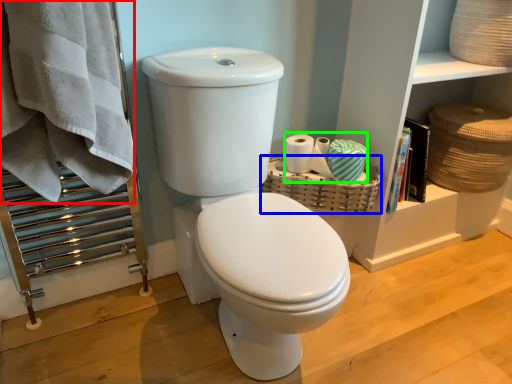
Question: Based on their relative distances, which object is farther from bath towel (highlighted by a red box)? Choose from basket (highlighted by a blue box) and toilet paper (highlighted by a green box).

Choices:
 (A) basket
 (B) toilet paper

Answer: (B)